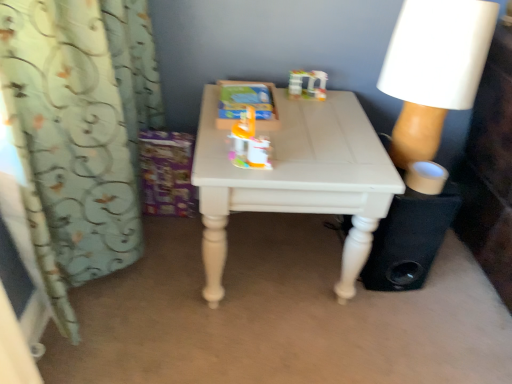
Image resolution: width=512 pixels, height=384 pixels. In order to click on translucent plastic toy at upper center, which appears as the first toy when viewed from the right in this screenshot , I will do `click(307, 84)`.

Image resolution: width=512 pixels, height=384 pixels. Describe the element at coordinates (434, 69) in the screenshot. I see `white matte lampshade at upper right` at that location.

This screenshot has width=512, height=384. What do you see at coordinates (296, 178) in the screenshot?
I see `white painted wood table at center` at bounding box center [296, 178].

Where is `black fabric speaker at lower right`? The image size is (512, 384). black fabric speaker at lower right is located at coordinates (x=409, y=239).

At what (x,y) coordinates should I click in order to perform the action: click on translucent plastic toy at upper center, the 2th toy when ordered from bottom to top. Please return your answer as a coordinate pair (x, y). The height and width of the screenshot is (384, 512). Looking at the image, I should click on (307, 84).

Find the location of a particular element. toy that is the 1st object located above the white painted wood table at center (from the image's perspective) is located at coordinates (249, 143).

Considering the sizes of objects orange plastic toy at center, positioned as the 2th toy in top-to-bottom order, and white painted wood table at center in the image provided, who is bigger, orange plastic toy at center, positioned as the 2th toy in top-to-bottom order, or white painted wood table at center?

white painted wood table at center.

Looking at their sizes, would you say orange plastic toy at center, which is the 1th toy in front-to-back order, is wider or thinner than white painted wood table at center?

Considering their sizes, orange plastic toy at center, which is the 1th toy in front-to-back order, looks slimmer than white painted wood table at center.

Is point (239, 134) farther from camera compared to point (273, 192)?

Yes, point (239, 134) is farther from viewer.

Who is more distant, white matte lampshade at upper right or translucent plastic toy at upper center, which is counted as the second toy, starting from the front?

translucent plastic toy at upper center, which is counted as the second toy, starting from the front, is behind.

Is white matte lampshade at upper right next to translucent plastic toy at upper center, the 2th toy when ordered from bottom to top, and touching it?

There is a gap between white matte lampshade at upper right and translucent plastic toy at upper center, the 2th toy when ordered from bottom to top.

Where is `lamp above the translucent plastic toy at upper center, the 2th toy when ordered from bottom to top (from a real-world perspective)`? This screenshot has height=384, width=512. lamp above the translucent plastic toy at upper center, the 2th toy when ordered from bottom to top (from a real-world perspective) is located at coordinates (434, 69).

Is translucent plastic toy at upper center, the 2th toy when ordered from bottom to top, inside white matte lampshade at upper right?

No, translucent plastic toy at upper center, the 2th toy when ordered from bottom to top, is located outside of white matte lampshade at upper right.

In terms of width, does black fabric speaker at lower right look wider or thinner when compared to white painted wood table at center?

Considering their sizes, black fabric speaker at lower right looks slimmer than white painted wood table at center.

From the picture: How different are the orientations of black fabric speaker at lower right and white painted wood table at center in degrees?

The angle between the facing direction of black fabric speaker at lower right and the facing direction of white painted wood table at center is 1.44 degrees.

Considering the positions of objects black fabric speaker at lower right and white painted wood table at center in the image provided, who is more to the left, black fabric speaker at lower right or white painted wood table at center?

Positioned to the left is white painted wood table at center.

Does black fabric speaker at lower right turn towards white painted wood table at center?

No.

Which object is positioned more to the left, translucent plastic toy at upper center, which appears as the first toy when viewed from the right, or white matte lampshade at upper right?

translucent plastic toy at upper center, which appears as the first toy when viewed from the right.

Does point (320, 95) appear closer or farther from the camera than point (466, 48)?

Point (320, 95) appears to be farther away from the viewer than point (466, 48).

Which object is more forward, translucent plastic toy at upper center, the second toy viewed from the left, or white matte lampshade at upper right?

white matte lampshade at upper right is closer to the camera.

Is white painted wood table at center positioned before orange plastic toy at center, which is the 2th toy in back-to-front order?

No.

Is white painted wood table at center aimed at orange plastic toy at center, which is the first toy in bottom-to-top order?

No, white painted wood table at center does not turn towards orange plastic toy at center, which is the first toy in bottom-to-top order.

From a real-world perspective, starting from the white painted wood table at center, which toy is the 2nd one vertically above it? Please provide its 2D coordinates.

[(249, 143)]

Based on the photo, is white painted wood table at center directly adjacent to orange plastic toy at center, positioned as the 2th toy in right-to-left order?

No, white painted wood table at center is not in contact with orange plastic toy at center, positioned as the 2th toy in right-to-left order.

Does white matte lampshade at upper right have a greater height compared to orange plastic toy at center, positioned as the 2th toy in right-to-left order?

Yes, white matte lampshade at upper right is taller than orange plastic toy at center, positioned as the 2th toy in right-to-left order.

Is white matte lampshade at upper right directly adjacent to orange plastic toy at center, positioned as the 2th toy in top-to-bottom order?

No.

From a real-world perspective, is white matte lampshade at upper right above or below orange plastic toy at center, which is the 1th toy in front-to-back order?

Clearly, from a real-world perspective, white matte lampshade at upper right is above orange plastic toy at center, which is the 1th toy in front-to-back order.

Between white matte lampshade at upper right and orange plastic toy at center, positioned as the 2th toy in top-to-bottom order, which one is positioned in front?

orange plastic toy at center, positioned as the 2th toy in top-to-bottom order.

From the image's perspective, is black fabric speaker at lower right below white matte lampshade at upper right?

Yes, from the image's perspective, black fabric speaker at lower right is beneath white matte lampshade at upper right.

Which object is closer to the camera taking this photo, black fabric speaker at lower right or white matte lampshade at upper right?

white matte lampshade at upper right is in front.

Is white matte lampshade at upper right completely or partially inside black fabric speaker at lower right?

No, black fabric speaker at lower right does not contain white matte lampshade at upper right.

Is black fabric speaker at lower right far away from white matte lampshade at upper right?

That's not correct — black fabric speaker at lower right is a little close to white matte lampshade at upper right.

At what (x,y) coordinates should I click in order to perform the action: click on table that is on the right side of orange plastic toy at center, which is the 2th toy in back-to-front order. Please return your answer as a coordinate pair (x, y). The image size is (512, 384). Looking at the image, I should click on (296, 178).

Where is `toy above the white matte lampshade at upper right (from the image's perspective)`? The height and width of the screenshot is (384, 512). toy above the white matte lampshade at upper right (from the image's perspective) is located at coordinates (307, 84).

Estimate the real-world distances between objects in this image. Which object is closer to light blue fabric curtain at left, white matte lampshade at upper right or white painted wood table at center?

Based on the image, white painted wood table at center appears to be nearer to light blue fabric curtain at left.

Considering their positions, is orange plastic toy at center, which is the 2th toy in back-to-front order, positioned closer to light blue fabric curtain at left than translucent plastic toy at upper center, which is counted as the second toy, starting from the front?

Based on the image, orange plastic toy at center, which is the 2th toy in back-to-front order, appears to be nearer to light blue fabric curtain at left.

Considering their positions, is white painted wood table at center positioned further to black fabric speaker at lower right than translucent plastic toy at upper center, the 1th toy from the back?

translucent plastic toy at upper center, the 1th toy from the back.

Which object lies nearer to the anchor point white matte lampshade at upper right, white painted wood table at center or light blue fabric curtain at left?

Among the two, white painted wood table at center is located nearer to white matte lampshade at upper right.

Consider the image. From the image, which object appears to be nearer to black fabric speaker at lower right, orange plastic toy at center, which is the first toy in bottom-to-top order, or white painted wood table at center?

white painted wood table at center is closer to black fabric speaker at lower right.

Looking at the image, which one is located further to light blue fabric curtain at left, white painted wood table at center or orange plastic toy at center, the 1th toy when ordered from left to right?

orange plastic toy at center, the 1th toy when ordered from left to right.

Looking at the image, which one is located closer to white painted wood table at center, black fabric speaker at lower right or orange plastic toy at center, the 1th toy when ordered from left to right?

orange plastic toy at center, the 1th toy when ordered from left to right.

Based on their spatial positions, is orange plastic toy at center, which is the 2th toy in back-to-front order, or light blue fabric curtain at left closer to translucent plastic toy at upper center, the second toy viewed from the left?

orange plastic toy at center, which is the 2th toy in back-to-front order, is closer to translucent plastic toy at upper center, the second toy viewed from the left.

Locate an element on the screen. toy between light blue fabric curtain at left and translucent plastic toy at upper center, placed as the 1th toy when sorted from top to bottom, in the horizontal direction is located at coordinates (249, 143).

At what (x,y) coordinates should I click in order to perform the action: click on toy between white painted wood table at center and white matte lampshade at upper right in the horizontal direction. Please return your answer as a coordinate pair (x, y). Looking at the image, I should click on pyautogui.click(x=307, y=84).

Where is `toy located between light blue fabric curtain at left and white painted wood table at center in the left-right direction`? The height and width of the screenshot is (384, 512). toy located between light blue fabric curtain at left and white painted wood table at center in the left-right direction is located at coordinates (249, 143).

At what (x,y) coordinates should I click in order to perform the action: click on table located between light blue fabric curtain at left and black fabric speaker at lower right in the left-right direction. Please return your answer as a coordinate pair (x, y). The width and height of the screenshot is (512, 384). Looking at the image, I should click on (296, 178).